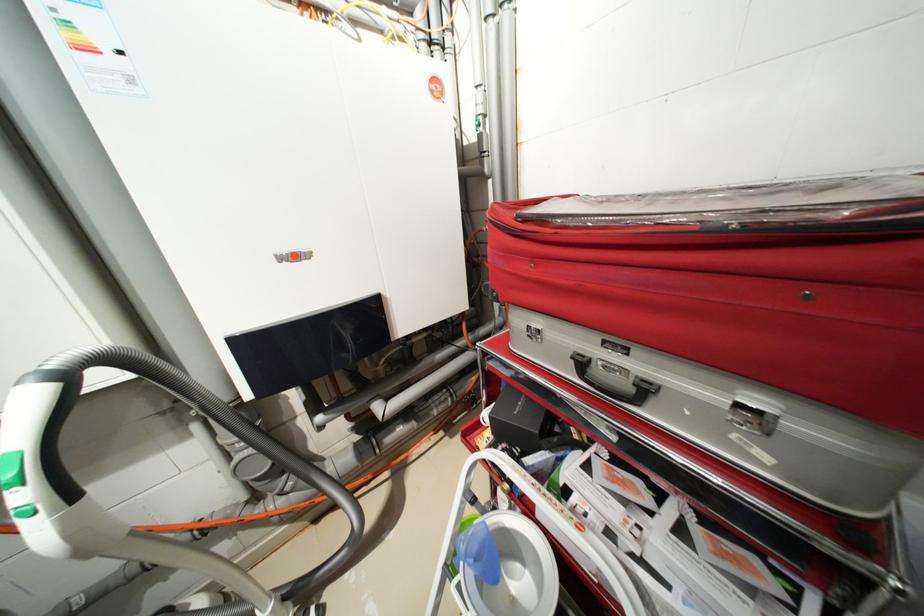
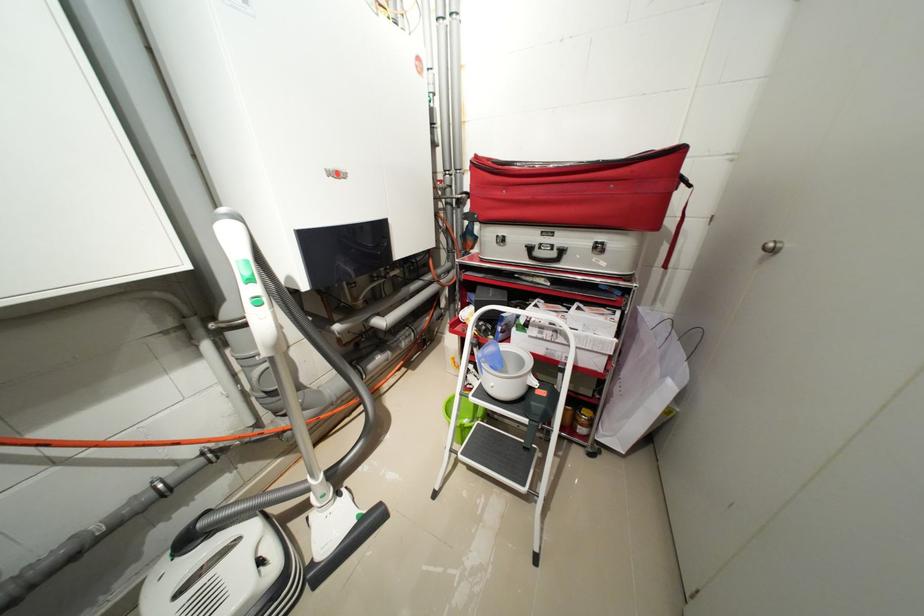
Which direction would the cameraman need to move to produce the second image?

The movement direction of the cameraman is left, backward.